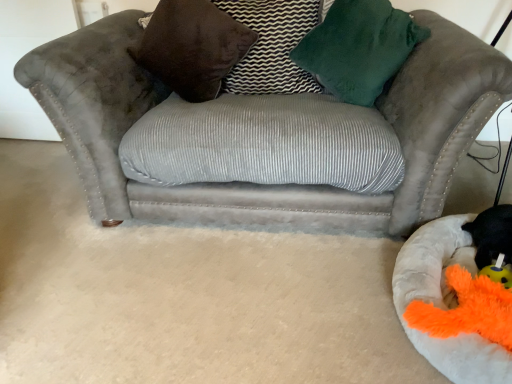
Locate an element on the screen. vacant space that's between suede gray couch at center and fluffy white dog bed at lower right is located at coordinates (257, 281).